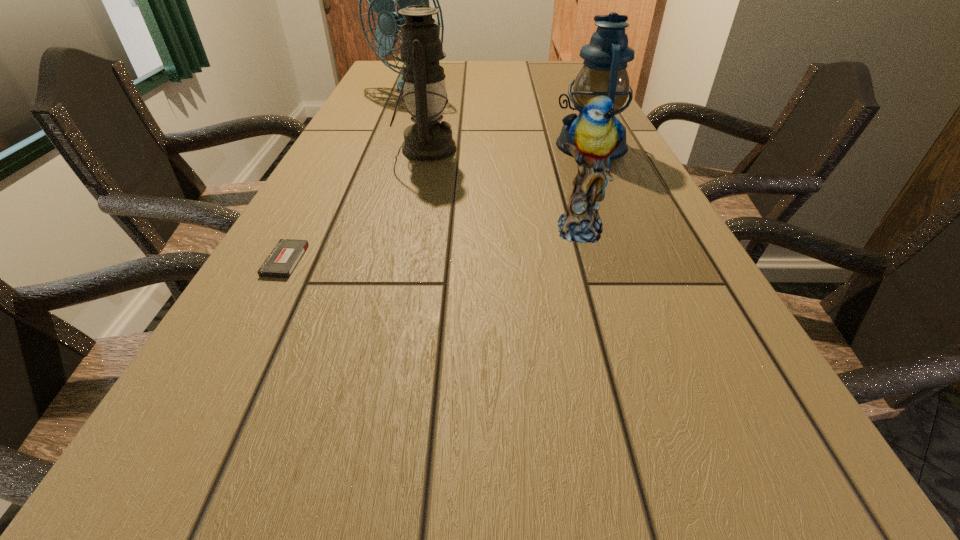
Identify the location of fan. The width and height of the screenshot is (960, 540). (381, 0).

Where is `oil lamp`? This screenshot has width=960, height=540. oil lamp is located at coordinates (425, 98).

This screenshot has width=960, height=540. Find the location of `lantern`. lantern is located at coordinates (604, 73).

This screenshot has height=540, width=960. I want to click on parrot, so click(596, 133).

At what (x,y) coordinates should I click in order to perform the action: click on videotape. Please return your answer as a coordinate pair (x, y). This screenshot has height=540, width=960. Looking at the image, I should click on (281, 262).

Locate an element on the screen. The image size is (960, 540). free space located 0.050m in front of the farthest object to blow air is located at coordinates (401, 108).

Locate an element on the screen. vacant area located on the back of the oil lamp is located at coordinates (435, 107).

Where is `free space located on the face of the lantern`? This screenshot has width=960, height=540. free space located on the face of the lantern is located at coordinates (497, 145).

The image size is (960, 540). I want to click on vacant area situated on the face of the lantern, so click(x=450, y=145).

Image resolution: width=960 pixels, height=540 pixels. I want to click on blank space located 0.230m on the face of the lantern, so click(x=466, y=145).